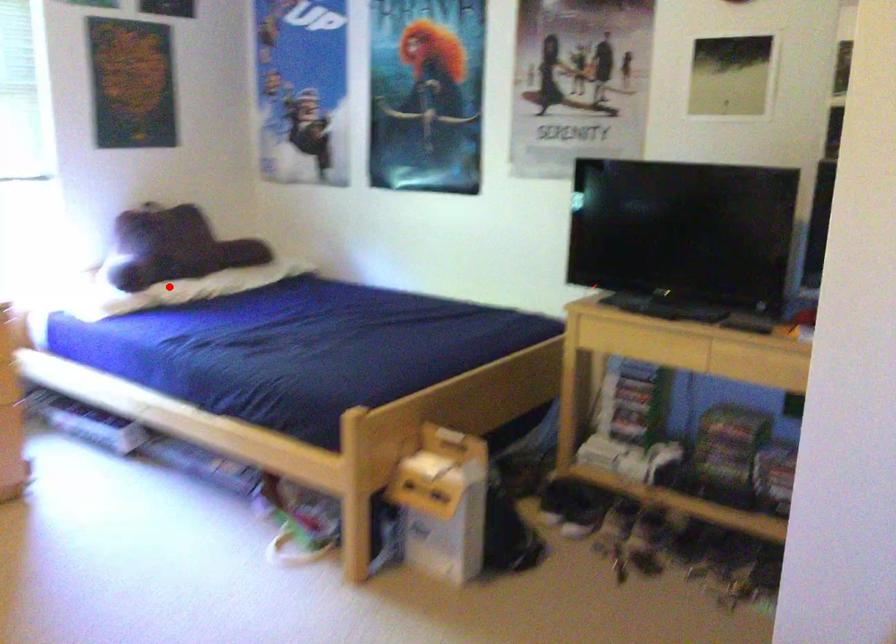
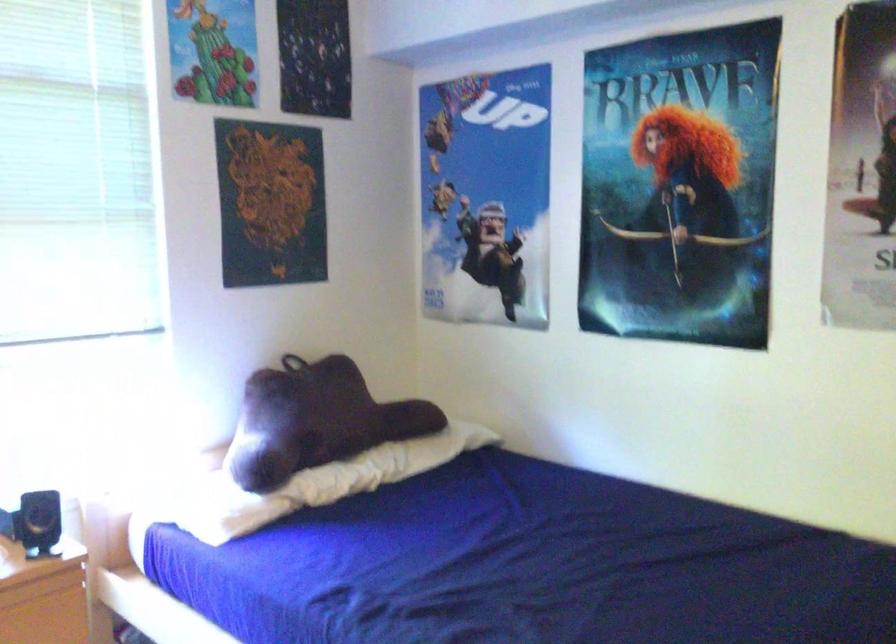
Where in the second image is the point corresponding to the highlighted location from the first image?

(314, 484)